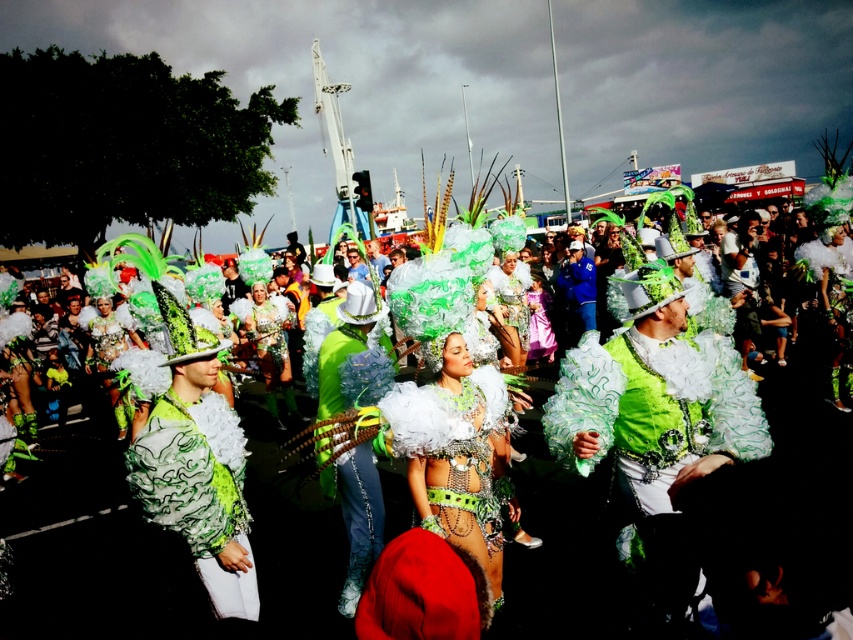
Question: Which object appears closest to the camera in this image?

Choices:
 (A) green matte fabric costume at center
 (B) green sequined jacket at center

Answer: (B)

Question: Which object appears closest to the camera in this image?

Choices:
 (A) green matte fabric costume at center
 (B) green sequined jacket at center
 (C) green shiny feathers at center

Answer: (B)

Question: Observing the image, what is the correct spatial positioning of green shiny feathers at center in reference to green matte fabric costume at center?

Choices:
 (A) below
 (B) above

Answer: (A)

Question: Can you confirm if green sequined jacket at center is smaller than green matte fabric costume at center?

Choices:
 (A) no
 (B) yes

Answer: (A)

Question: Does green shiny feathers at center have a lesser width compared to green sequined jacket at center?

Choices:
 (A) no
 (B) yes

Answer: (B)

Question: Which point is closer to the camera taking this photo?

Choices:
 (A) (729, 374)
 (B) (224, 561)
 (C) (94, 509)

Answer: (B)